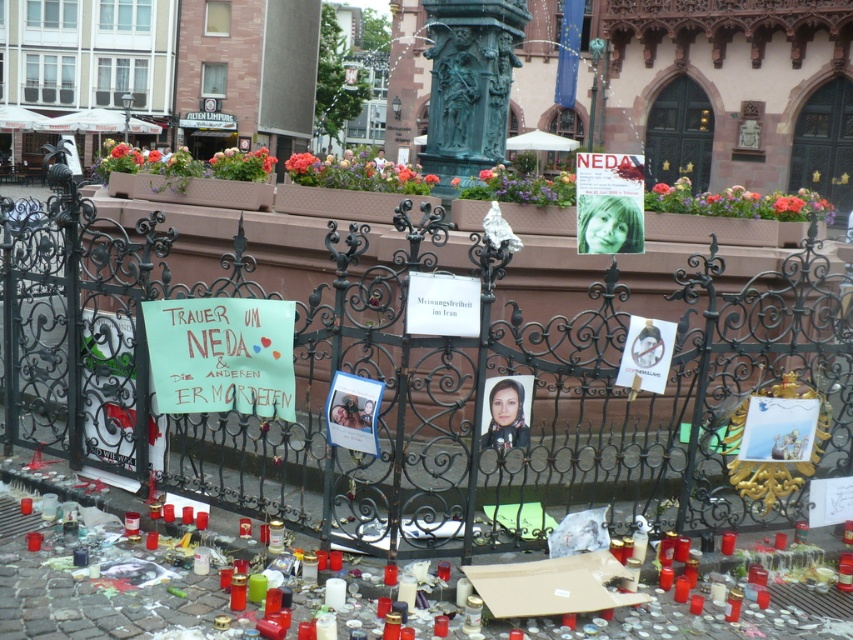
You are an art student analyzing the memorial setup. You notice the green patinated bronze statue at center and the matte paper poster at center. Which object is bigger in size?

The green patinated bronze statue at center is larger in size compared to the matte paper poster at center.

You are an art student analyzing the memorial setup. You see the green patinated bronze statue at center and the matte paper photo frame at center. Which object is positioned higher in the scene?

The green patinated bronze statue at center is located above the matte paper photo frame at center, so it is positioned higher in the scene.